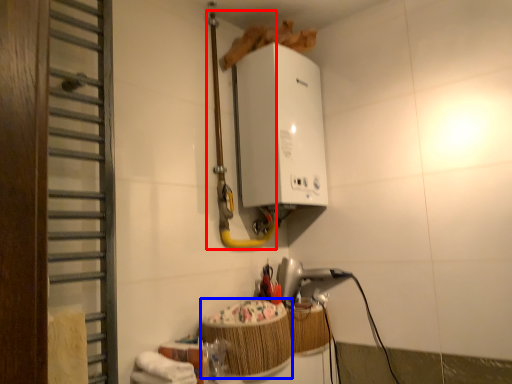
Question: Among these objects, which one is nearest to the camera, pipe (highlighted by a red box) or basket (highlighted by a blue box)?

Choices:
 (A) pipe
 (B) basket

Answer: (B)